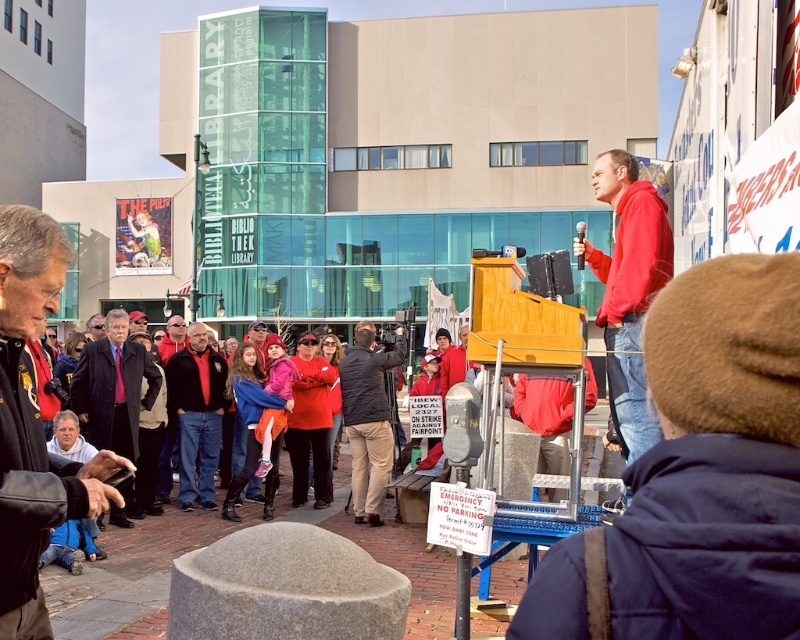
Question: Is red jacket at center above khaki pants at center?

Choices:
 (A) no
 (B) yes

Answer: (A)

Question: Which object appears farthest from the camera in this image?

Choices:
 (A) red hoodie at center
 (B) red jacket at center
 (C) khaki pants at center

Answer: (B)

Question: Can you confirm if red jacket at center is positioned to the right of red fabric jacket at center?

Choices:
 (A) no
 (B) yes

Answer: (B)

Question: Which of the following is the farthest from the observer?

Choices:
 (A) (152, 404)
 (B) (176, 460)

Answer: (B)

Question: Does red hoodie at center have a lesser width compared to red fabric jacket at center?

Choices:
 (A) no
 (B) yes

Answer: (A)

Question: Which of these objects is positioned farthest from the red fabric jacket at center?

Choices:
 (A) black leather jacket at lower left
 (B) red jacket at center

Answer: (A)